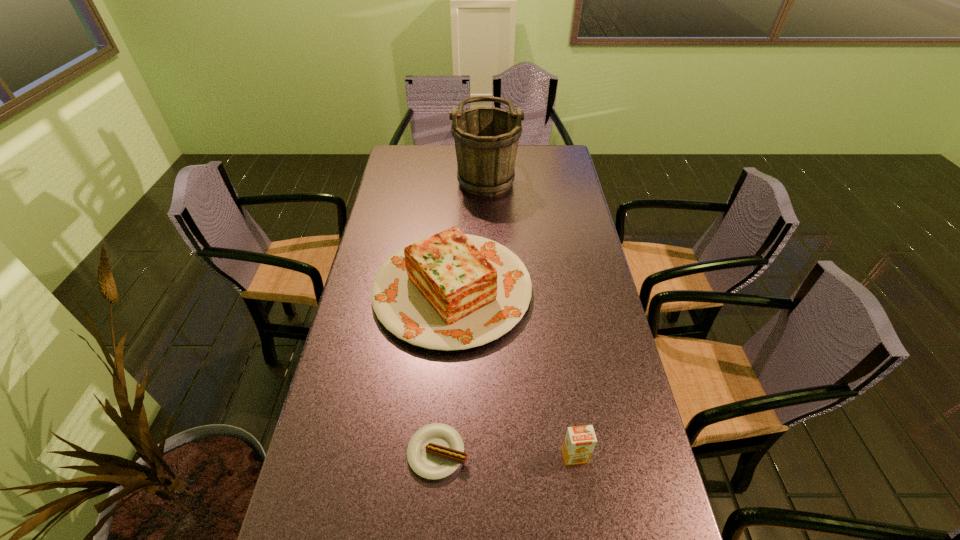
The height and width of the screenshot is (540, 960). Find the location of `vacant position located on the right of the third nearest object`. vacant position located on the right of the third nearest object is located at coordinates (562, 290).

Find the location of a particular element. The width and height of the screenshot is (960, 540). vacant space located on the left of the rightmost object is located at coordinates (529, 456).

I want to click on free spot located on the right of the shortest object, so pyautogui.click(x=610, y=453).

Find the location of a particular element. The image size is (960, 540). object present at the far edge is located at coordinates (486, 139).

This screenshot has height=540, width=960. What are the coordinates of `object situated at the left edge` in the screenshot? It's located at (451, 291).

The height and width of the screenshot is (540, 960). Identify the location of object that is at the right edge. (579, 443).

This screenshot has height=540, width=960. Find the location of `vacant space at the far edge of the desktop`. vacant space at the far edge of the desktop is located at coordinates (518, 150).

At what (x,y) coordinates should I click in order to perform the action: click on vacant space at the left edge of the desktop. Please return your answer as a coordinate pair (x, y). This screenshot has height=540, width=960. Looking at the image, I should click on (411, 173).

You are a GUI agent. You are given a task and a screenshot of the screen. Output one action in this format:
    pyautogui.click(x=<x>, y=<y>)
    Task: Click on the free space at the right edge of the desktop
    This screenshot has height=540, width=960.
    Given the screenshot: What is the action you would take?
    pyautogui.click(x=589, y=420)

Where is `vacant space at the far left corner of the desktop`? The height and width of the screenshot is (540, 960). vacant space at the far left corner of the desktop is located at coordinates (396, 150).